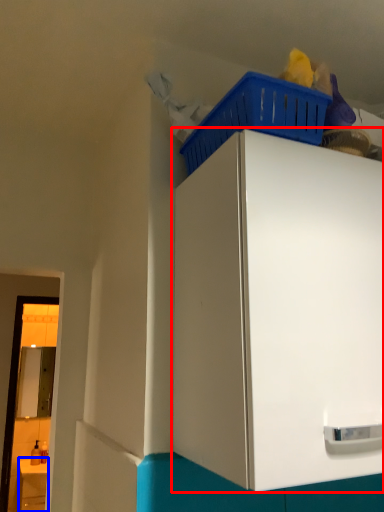
Question: Which object appears closest to the camera in this image, cabinetry (highlighted by a red box) or counter (highlighted by a blue box)?

Choices:
 (A) cabinetry
 (B) counter

Answer: (A)